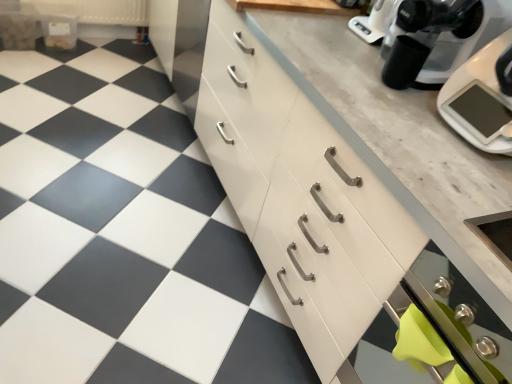
I want to click on white glossy cabinet at upper right, which is the 2th cabinetry from bottom to top, so click(x=180, y=44).

This screenshot has height=384, width=512. What do you see at coordinates (482, 97) in the screenshot? I see `white glossy kitchen scale at upper right` at bounding box center [482, 97].

In order to click on white glossy cabinet at upper right, placed as the 1th cabinetry when sorted from back to front in this screenshot , I will do `click(180, 44)`.

Looking at this image, from the image's perspective, who appears lower, white glossy tile at center or stainless steel oven at lower right?

From the image's view, stainless steel oven at lower right is below.

Based on the photo, could you tell me if white glossy tile at center is facing stainless steel oven at lower right?

No, white glossy tile at center is not facing towards stainless steel oven at lower right.

The width and height of the screenshot is (512, 384). In the image, there is a stainless steel oven at lower right. Identify the location of tile below it (from a real-world perspective). (123, 235).

From a real-world perspective, is white glossy tile at center below stainless steel oven at lower right?

Correct, in the physical world, white glossy tile at center is lower than stainless steel oven at lower right.

Can you see stainless steel oven at lower right touching white glossy kitchen scale at upper right?

stainless steel oven at lower right and white glossy kitchen scale at upper right are clearly separated.

Considering the relative positions of stainless steel oven at lower right and white glossy kitchen scale at upper right in the image provided, is stainless steel oven at lower right in front of white glossy kitchen scale at upper right?

Yes, stainless steel oven at lower right is closer to the viewer.

Can you confirm if stainless steel oven at lower right is shorter than white glossy kitchen scale at upper right?

In fact, stainless steel oven at lower right may be taller than white glossy kitchen scale at upper right.

Could you tell me if stainless steel oven at lower right is turned towards white glossy kitchen scale at upper right?

No, stainless steel oven at lower right is not turned towards white glossy kitchen scale at upper right.

Does point (194, 68) lie behind point (414, 128)?

Yes, it is.

From the picture: Is white glossy cabinet at upper right, placed as the 1th cabinetry when sorted from back to front, at the left side of white wood cabinet at center, the 2th cabinetry from the back?

Yes, white glossy cabinet at upper right, placed as the 1th cabinetry when sorted from back to front, is to the left of white wood cabinet at center, the 2th cabinetry from the back.

What's the angular difference between white glossy cabinet at upper right, placed as the 1th cabinetry when sorted from back to front, and white wood cabinet at center, the second cabinetry from the top,'s facing directions?

0.000684 degrees separate the facing orientations of white glossy cabinet at upper right, placed as the 1th cabinetry when sorted from back to front, and white wood cabinet at center, the second cabinetry from the top.

Is white glossy cabinet at upper right, which is the 2th cabinetry from bottom to top, taller than white wood cabinet at center, placed as the first cabinetry when sorted from front to back?

Incorrect, the height of white glossy cabinet at upper right, which is the 2th cabinetry from bottom to top, is not larger of that of white wood cabinet at center, placed as the first cabinetry when sorted from front to back.

From a real-world perspective, between white glossy tile at center and white glossy cabinet at upper right, placed as the 1th cabinetry when sorted from top to bottom, who is vertically lower?

From a 3D spatial view, white glossy tile at center is below.

Which object is closer to the camera, white glossy tile at center or white glossy cabinet at upper right, placed as the 1th cabinetry when sorted from top to bottom?

white glossy tile at center is more forward.

Which is more to the left, white glossy tile at center or white glossy cabinet at upper right, which is the 2th cabinetry from bottom to top?

white glossy tile at center.

Which object is further away from the camera, stainless steel oven at lower right or white glossy tile at center?

white glossy tile at center is further from the camera.

How many degrees apart are the facing directions of stainless steel oven at lower right and white glossy tile at center?

89.8 degrees separate the facing orientations of stainless steel oven at lower right and white glossy tile at center.

How much distance is there between stainless steel oven at lower right and white glossy tile at center?

They are 35.62 inches apart.

Is point (415, 355) positioned behind point (62, 309)?

That is False.

Does white wood cabinet at center, positioned as the 1th cabinetry in bottom-to-top order, appear on the right side of white glossy tile at center?

Correct, you'll find white wood cabinet at center, positioned as the 1th cabinetry in bottom-to-top order, to the right of white glossy tile at center.

Measure the distance between white wood cabinet at center, the 2th cabinetry from the back, and white glossy tile at center.

The distance of white wood cabinet at center, the 2th cabinetry from the back, from white glossy tile at center is 24.73 inches.

From their relative heights in the image, would you say white wood cabinet at center, the second cabinetry from the top, is taller or shorter than white glossy tile at center?

Clearly, white wood cabinet at center, the second cabinetry from the top, is taller compared to white glossy tile at center.

From the picture: Is white wood cabinet at center, placed as the first cabinetry when sorted from front to back, not near white glossy tile at center?

No, white wood cabinet at center, placed as the first cabinetry when sorted from front to back, is not far away from white glossy tile at center.

Does black plastic coffee maker at upper right have a smaller size compared to white wood cabinet at center, placed as the first cabinetry when sorted from front to back?

Indeed, black plastic coffee maker at upper right has a smaller size compared to white wood cabinet at center, placed as the first cabinetry when sorted from front to back.

Between black plastic coffee maker at upper right and white wood cabinet at center, positioned as the 1th cabinetry in bottom-to-top order, which one has less height?

Standing shorter between the two is black plastic coffee maker at upper right.

Does black plastic coffee maker at upper right touch white wood cabinet at center, the 2th cabinetry from the back?

There is a gap between black plastic coffee maker at upper right and white wood cabinet at center, the 2th cabinetry from the back.

Is point (444, 25) more distant than point (345, 357)?

No, (444, 25) is closer to viewer.

This screenshot has height=384, width=512. Identify the location of oven in front of the white glossy tile at center. (432, 332).

Image resolution: width=512 pixels, height=384 pixels. Identify the location of home appliance lying behind the stainless steel oven at lower right. (482, 97).

Considering their positions, is white glossy tile at center positioned closer to black plastic coffee maker at upper right than white glossy kitchen scale at upper right?

white glossy kitchen scale at upper right is positioned closer to the anchor black plastic coffee maker at upper right.

Which object lies nearer to the anchor point black plastic coffee maker at upper right, white wood cabinet at center, positioned as the 1th cabinetry in bottom-to-top order, or white glossy cabinet at upper right, which is the 2th cabinetry from bottom to top?

white wood cabinet at center, positioned as the 1th cabinetry in bottom-to-top order, lies closer to black plastic coffee maker at upper right than the other object.

Considering their positions, is white wood cabinet at center, the 2th cabinetry from the back, positioned further to black plastic coffee maker at upper right than white glossy tile at center?

The object further to black plastic coffee maker at upper right is white glossy tile at center.

From the picture: Based on their spatial positions, is black plastic coffee maker at upper right or white glossy cabinet at upper right, acting as the 2th cabinetry starting from the front, closer to stainless steel oven at lower right?

Based on the image, black plastic coffee maker at upper right appears to be nearer to stainless steel oven at lower right.

When comparing their distances from white glossy kitchen scale at upper right, does white wood cabinet at center, positioned as the 1th cabinetry in bottom-to-top order, or stainless steel oven at lower right seem further?

stainless steel oven at lower right lies further to white glossy kitchen scale at upper right than the other object.

From the picture: From the image, which object appears to be farther from black plastic coffee maker at upper right, stainless steel oven at lower right or white wood cabinet at center, the 2th cabinetry from the back?

stainless steel oven at lower right lies further to black plastic coffee maker at upper right than the other object.

When comparing their distances from white glossy kitchen scale at upper right, does white wood cabinet at center, positioned as the 1th cabinetry in bottom-to-top order, or white glossy cabinet at upper right, which is the 2th cabinetry from bottom to top, seem further?

white glossy cabinet at upper right, which is the 2th cabinetry from bottom to top, lies further to white glossy kitchen scale at upper right than the other object.

Which object lies further to the anchor point white wood cabinet at center, the 2th cabinetry from the back, white glossy tile at center or white glossy cabinet at upper right, placed as the 1th cabinetry when sorted from top to bottom?

white glossy cabinet at upper right, placed as the 1th cabinetry when sorted from top to bottom.

I want to click on home appliance between black plastic coffee maker at upper right and stainless steel oven at lower right vertically, so click(x=482, y=97).

In order to click on oven located between white glossy tile at center and white glossy kitchen scale at upper right in the left-right direction in this screenshot , I will do `click(432, 332)`.

Where is `kitchen appliance located between white glossy kitchen scale at upper right and white glossy cabinet at upper right, placed as the 1th cabinetry when sorted from top to bottom, in the depth direction`? This screenshot has width=512, height=384. kitchen appliance located between white glossy kitchen scale at upper right and white glossy cabinet at upper right, placed as the 1th cabinetry when sorted from top to bottom, in the depth direction is located at coordinates (435, 30).

Locate an element on the screen. This screenshot has height=384, width=512. tile between stainless steel oven at lower right and white glossy cabinet at upper right, which is the 2th cabinetry from bottom to top, from front to back is located at coordinates (123, 235).